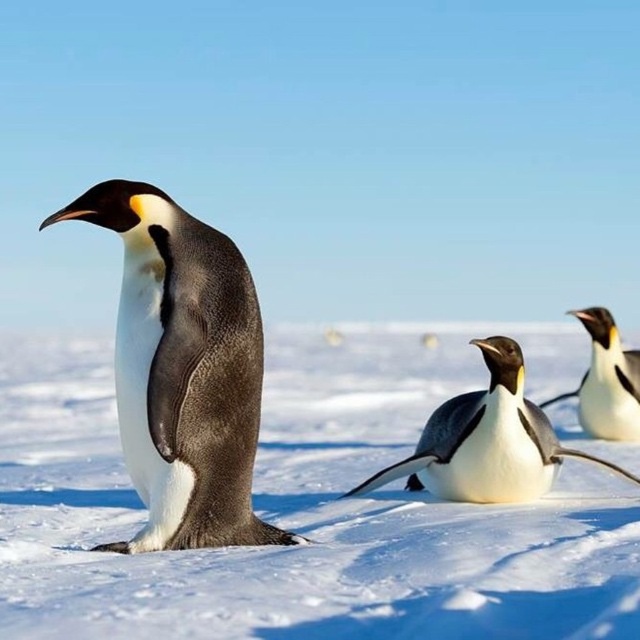
Question: In this image, where is black matte penguin at center located relative to white glossy penguin at center?

Choices:
 (A) right
 (B) left

Answer: (B)

Question: Among these objects, which one is farthest from the camera?

Choices:
 (A) black matte penguin at center
 (B) white glossy penguin at center

Answer: (B)

Question: Which point is closer to the camera?

Choices:
 (A) (88, 561)
 (B) (516, 474)
 (C) (163, 524)

Answer: (A)

Question: Among these points, which one is farthest from the camera?

Choices:
 (A) (636, 417)
 (B) (520, 420)

Answer: (A)

Question: Does black matte penguin at center lie behind black glossy penguin at center?

Choices:
 (A) no
 (B) yes

Answer: (A)

Question: Is white fluffy snow at center positioned in front of black glossy penguin at center?

Choices:
 (A) no
 (B) yes

Answer: (B)